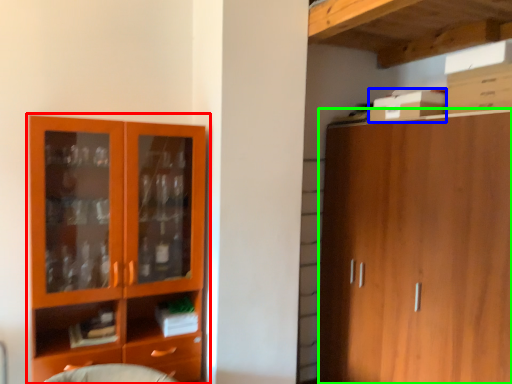
Question: Based on their relative distances, which object is nearer to cupboard (highlighted by a red box)? Choose from cardboard box (highlighted by a blue box) and cabinetry (highlighted by a green box).

Choices:
 (A) cardboard box
 (B) cabinetry

Answer: (B)